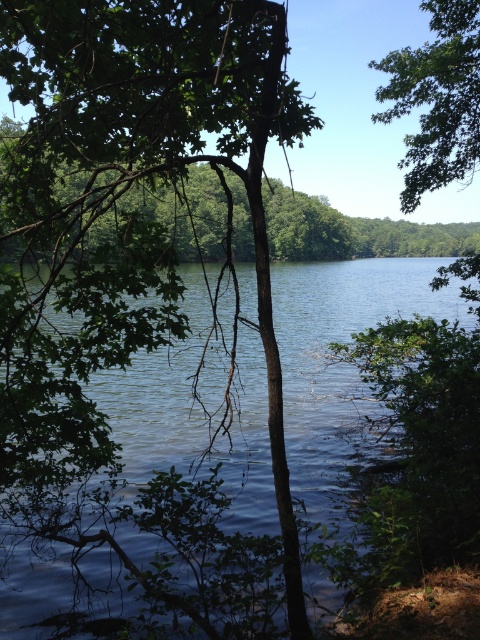
Question: Does blue water at center appear on the right side of brown dirt at lower right?

Choices:
 (A) no
 (B) yes

Answer: (A)

Question: In this image, where is green leafy tree at upper right located relative to brown dirt at lower right?

Choices:
 (A) below
 (B) above

Answer: (B)

Question: Which object appears closest to the camera in this image?

Choices:
 (A) brown dirt at lower right
 (B) green leafy tree at upper right

Answer: (A)

Question: Which of the following is the farthest from the observer?

Choices:
 (A) blue water at center
 (B) green leafy tree at center
 (C) brown dirt at lower right

Answer: (C)

Question: Which point is farther from the camera taking this photo?

Choices:
 (A) (432, 602)
 (B) (278, 102)
 (C) (357, 385)
 (D) (434, 172)

Answer: (C)

Question: Considering the relative positions of blue water at center and brown dirt at lower right in the image provided, where is blue water at center located with respect to brown dirt at lower right?

Choices:
 (A) left
 (B) right

Answer: (A)